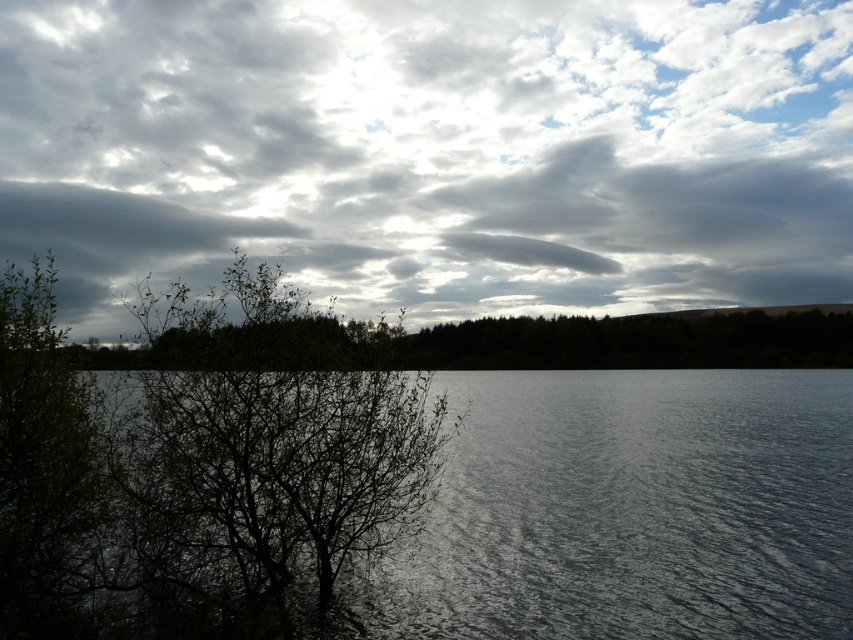
You are an artist trying to paint the scene. You want to paint the cloudy sky at upper center and the green leafy tree at center. Which object should you paint first to follow the proper layering technique?

You should paint the cloudy sky at upper center first because the green leafy tree at center is behind it, so painting the sky first allows the tree to be layered over it properly.

You are standing at the edge of the lake and notice the glossy water at lower left and the green leafy tree at lower left. Which one is wider?

The glossy water at lower left is less wide than the green leafy tree at lower left, so the green leafy tree at lower left is wider.

You are an observer looking at the scene. You notice the cloudy sky at upper center and the green leafy tree at lower left. Which object is positioned higher in the image?

The cloudy sky at upper center is positioned higher in the image than the green leafy tree at lower left.